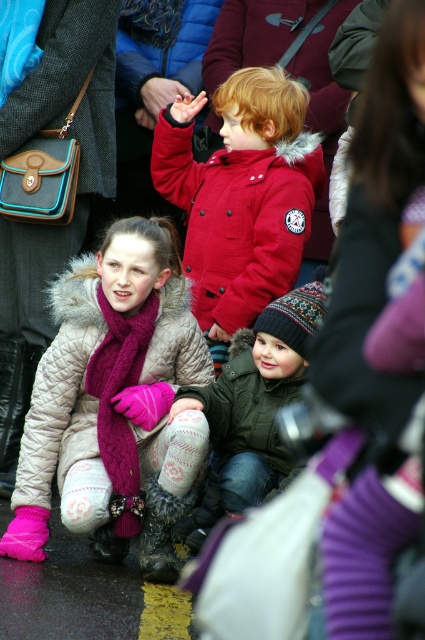
Question: Where is red matte jacket at center located in relation to green quilted jacket at center in the image?

Choices:
 (A) below
 (B) above

Answer: (B)

Question: Which point appears farthest from the camera in this image?

Choices:
 (A) (122, 506)
 (B) (84, 268)
 (C) (153, 548)

Answer: (B)

Question: Is green quilted jacket at center closer to camera compared to fuzzy black boot at lower center?

Choices:
 (A) yes
 (B) no

Answer: (B)

Question: In this image, where is red matte jacket at center located relative to green quilted jacket at center?

Choices:
 (A) right
 (B) left

Answer: (A)

Question: Which object is the closest to the fuzzy black boot at lower center?

Choices:
 (A) green fuzzy jacket at center
 (B) red matte jacket at center
 (C) knitted magenta scarf at lower left
 (D) green quilted jacket at center

Answer: (C)

Question: Based on their relative distances, which object is nearer to the green quilted jacket at center?

Choices:
 (A) knitted magenta scarf at lower left
 (B) green fuzzy jacket at center

Answer: (B)